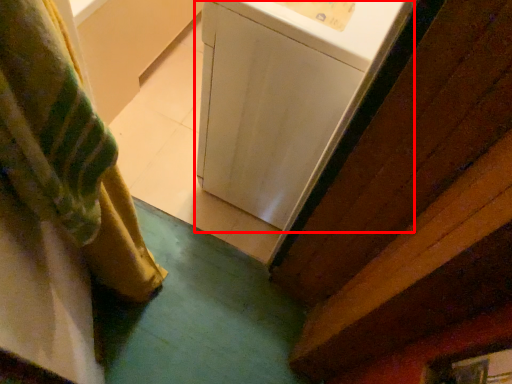
Question: Where is washing machine (annotated by the red box) located in relation to curtain in the image?

Choices:
 (A) right
 (B) left

Answer: (A)